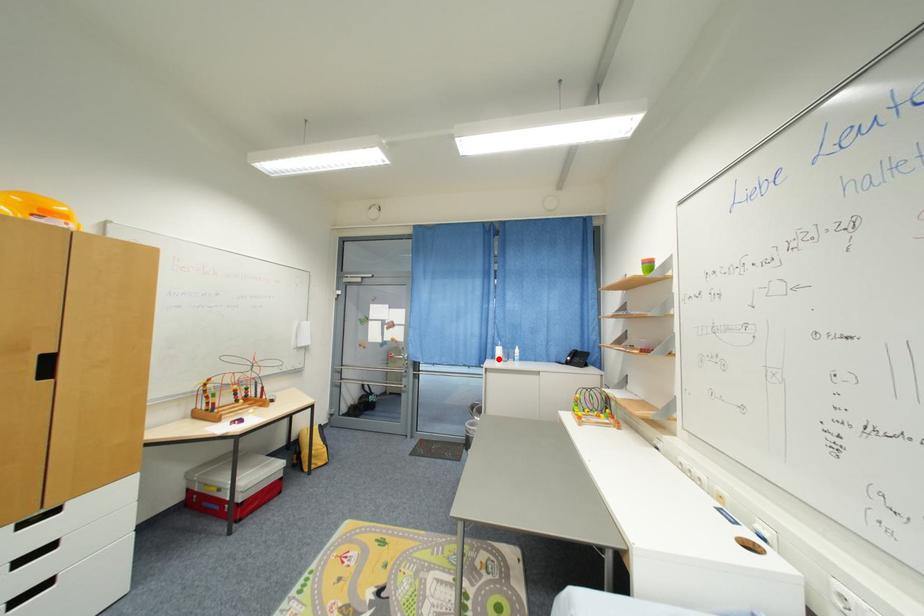
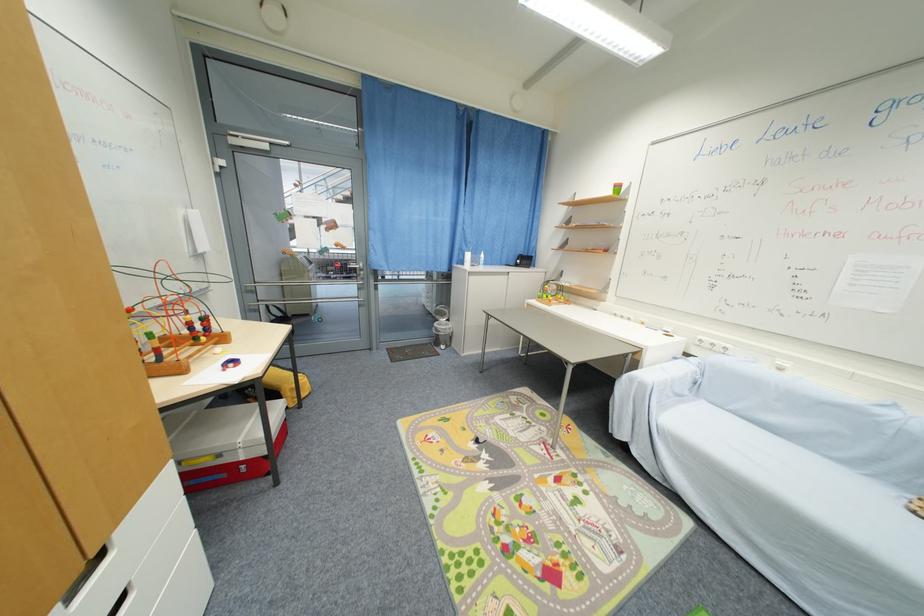
Question: I am providing you with two images of the same scene from different viewpoints. A red point is shown in image1. For the corresponding object point in image2, is it positioned nearer or farther from the camera?

Choices:
 (A) Nearer
 (B) Farther

Answer: (A)